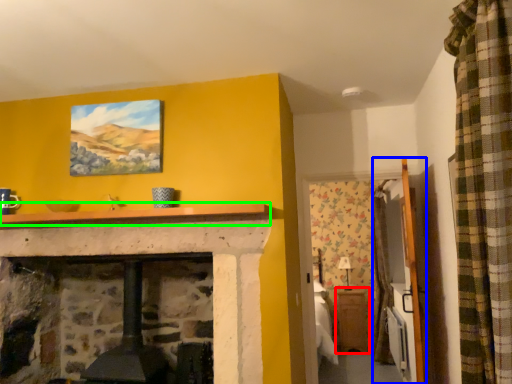
Question: Which object is the closest to the table (highlighted by a red box)? Choose among these: armoire (highlighted by a blue box) or mantle (highlighted by a green box).

Choices:
 (A) armoire
 (B) mantle

Answer: (A)